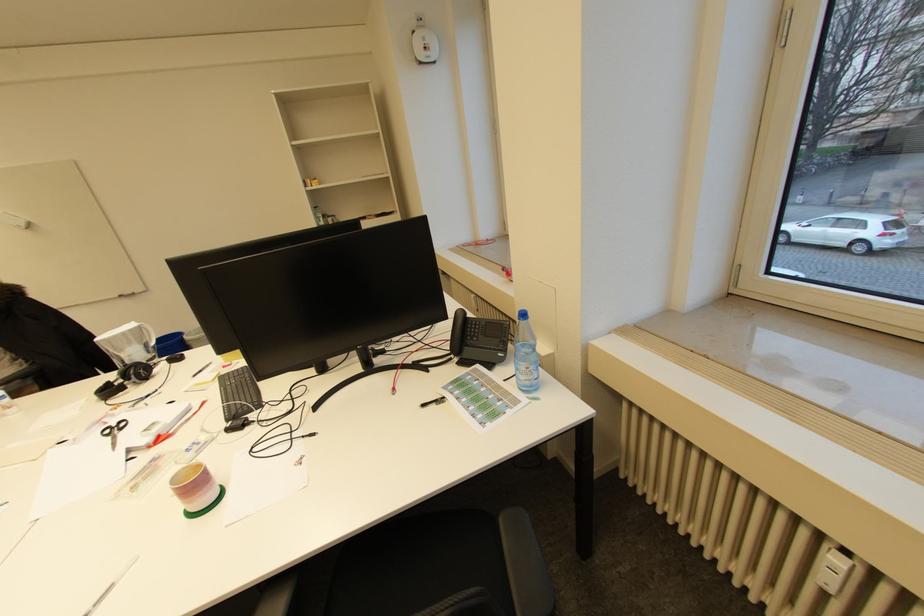
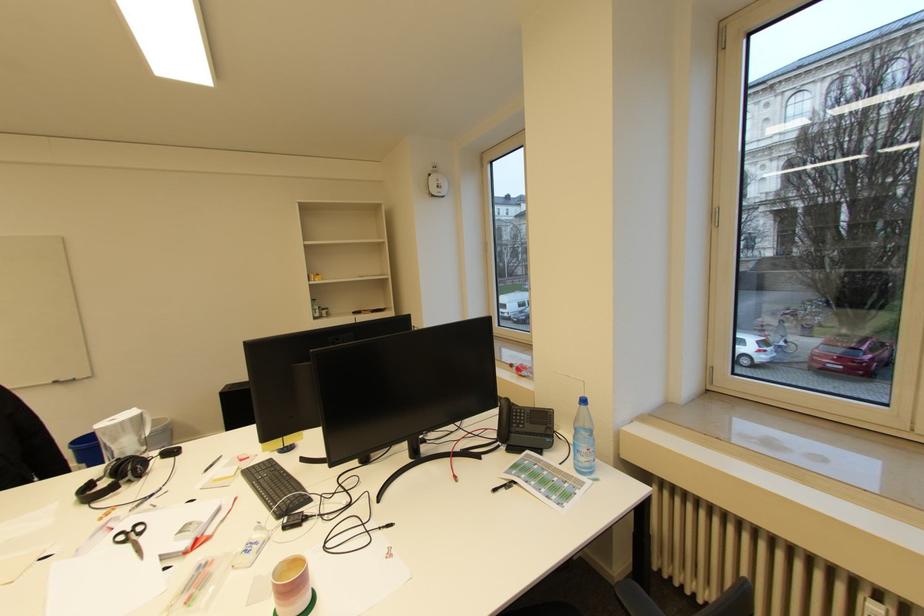
Locate, in the second image, the point that corresponds to pixel 481 329 in the first image.

(527, 416)